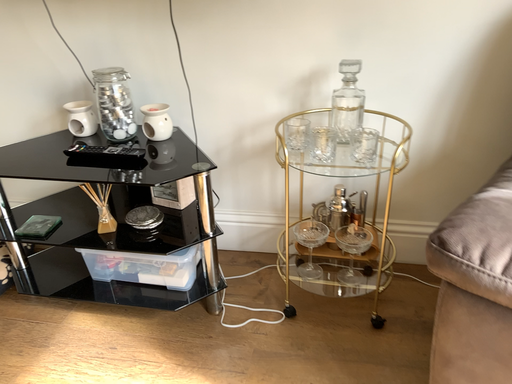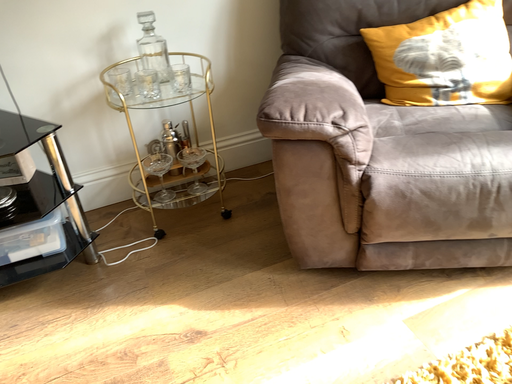
Question: How did the camera likely rotate when shooting the video?

Choices:
 (A) rotated right
 (B) rotated left

Answer: (A)